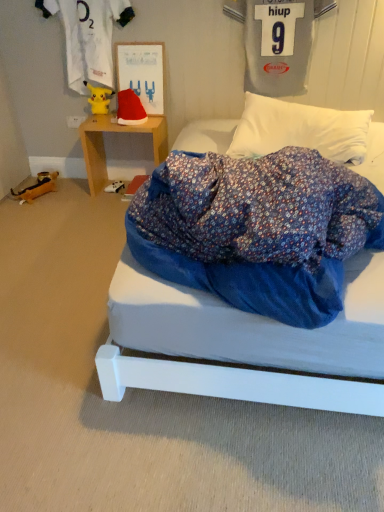
Image resolution: width=384 pixels, height=512 pixels. What are the coordinates of `vacant space in between wooden toy at left, the second toy positioned from the right, and wooden table at left` in the screenshot? It's located at (76, 192).